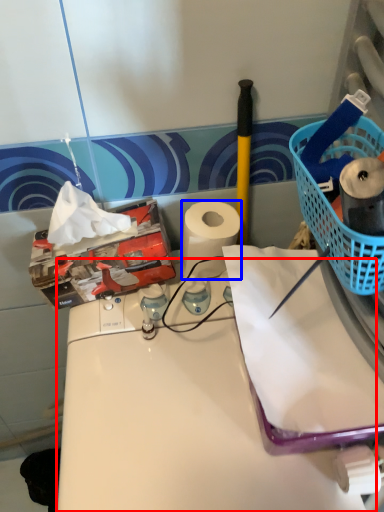
Question: Which point is further to the camera, counter (highlighted by a red box) or paper towel (highlighted by a blue box)?

Choices:
 (A) counter
 (B) paper towel

Answer: (B)